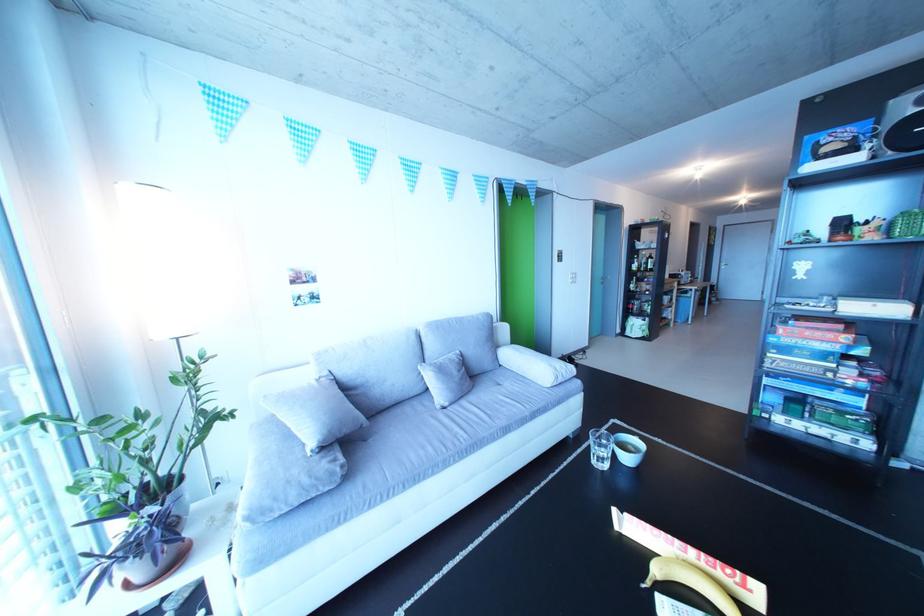
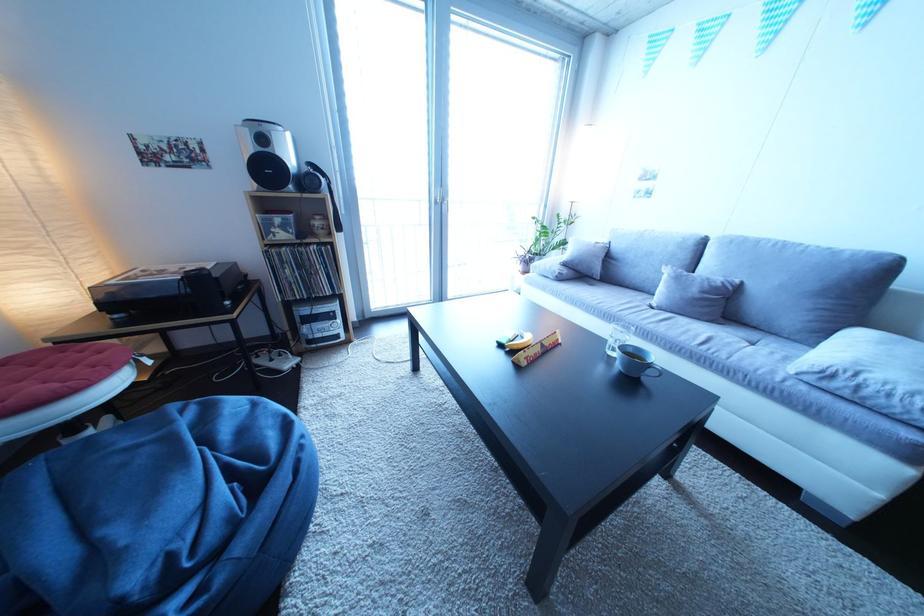
The point at [470,358] is marked in the first image. Where is the corresponding point in the second image?

(750, 286)